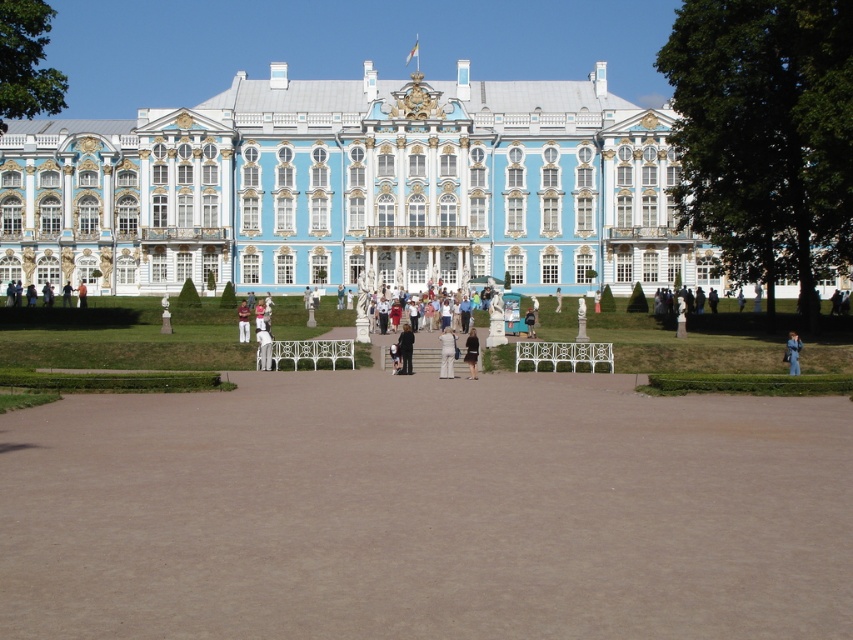
You are standing at the entrance of the palace and want to find the dark gray suit at center. Which direction should you walk to reach it?

The dark gray suit at center is located at point coordinates 0.545 on the x axis and 0.476 on the y axis. Since you are at the entrance, which is likely at the front of the palace, you should walk towards the center of the courtyard to reach the dark gray suit at center.

Based on the photo, you are planning to place a small garden statue in the courtyard of the palace. The statue requires a space wider than the white fabric pants at center. Can the brown gravel at center accommodate this statue?

The brown gravel at center has a width that surpasses the white fabric pants at center, so yes, the statue can be placed there as it meets the required width.

You are a photographer planning to take a picture of the white cotton pants at center and the blue fabric coat at center in the palace courtyard. Which of the two items should you focus on first if you want to capture the wider object in your frame?

The blue fabric coat at center is wider than the white cotton pants at center, so you should focus on the blue fabric coat at center first to capture the wider object in your frame.